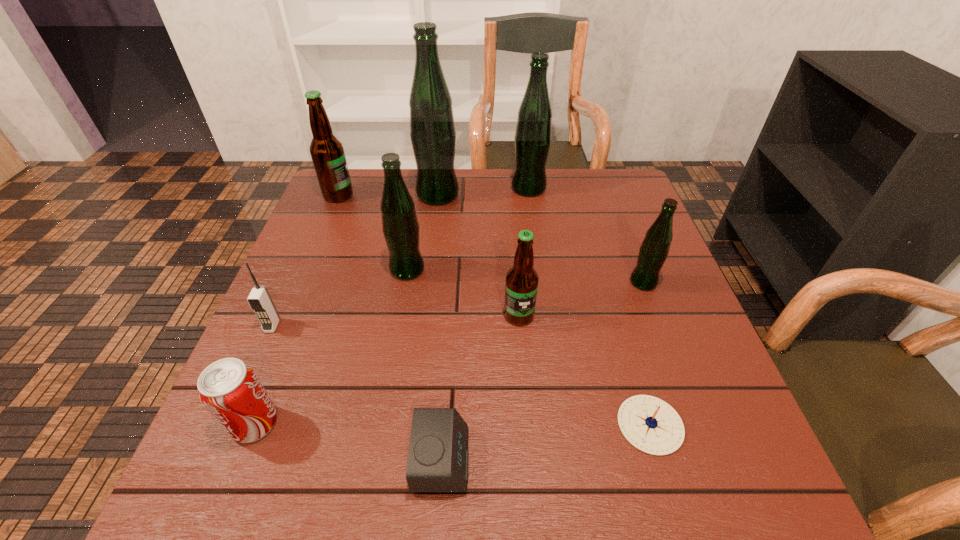
This screenshot has width=960, height=540. Identify the location of the smallest green beer bottle. (653, 252).

At what (x,y) coordinates should I click in order to perform the action: click on cellular telephone. Please return your answer as a coordinate pair (x, y). This screenshot has height=540, width=960. Looking at the image, I should click on (259, 299).

What are the coordinates of `soda can` in the screenshot? It's located at (229, 388).

At what (x,y) coordinates should I click in order to perform the action: click on red soda can. Please return your answer as a coordinate pair (x, y). Looking at the image, I should click on (229, 388).

At what (x,y) coordinates should I click in order to perform the action: click on alarm clock. Please return your answer as a coordinate pair (x, y). Looking at the image, I should click on (438, 458).

I want to click on the ninth tallest object, so click(438, 458).

Identify the location of the shortest object. This screenshot has height=540, width=960. (650, 424).

This screenshot has width=960, height=540. In order to click on blue compass in this screenshot , I will do `click(650, 424)`.

Image resolution: width=960 pixels, height=540 pixels. Find the location of `vacant space located 0.280m on the right of the biggest green beer bottle`. vacant space located 0.280m on the right of the biggest green beer bottle is located at coordinates (555, 195).

This screenshot has width=960, height=540. What are the coordinates of `free point located 0.100m on the front of the third smallest green beer bottle` in the screenshot? It's located at (533, 219).